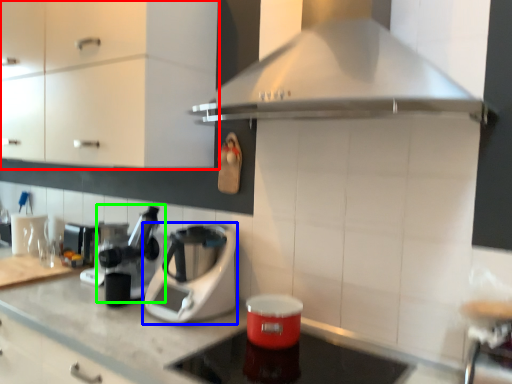
Question: Estimate the real-world distances between objects in this image. Which object is closer to cabinetry (highlighted by a red box), kitchen appliance (highlighted by a blue box) or coffee machine (highlighted by a green box)?

Choices:
 (A) kitchen appliance
 (B) coffee machine

Answer: (B)